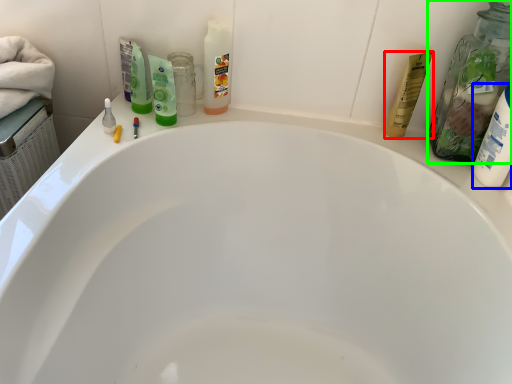
Question: Which object is positioned closest to toiletry (highlighted by a red box)? Select from toiletry (highlighted by a blue box) and cleaning product (highlighted by a green box).

Choices:
 (A) toiletry
 (B) cleaning product

Answer: (B)